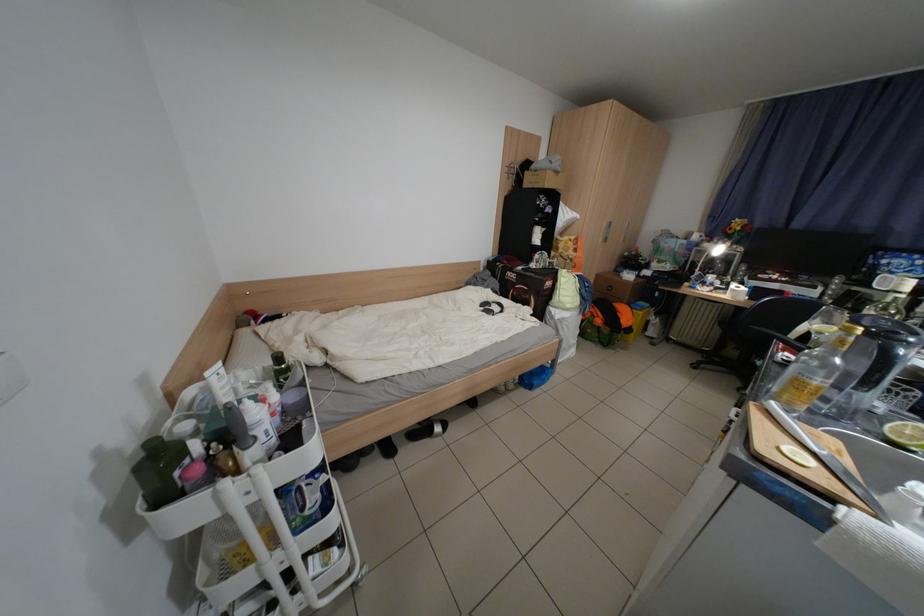
Describe the element at coordinates (219, 384) in the screenshot. I see `the white bottle pump` at that location.